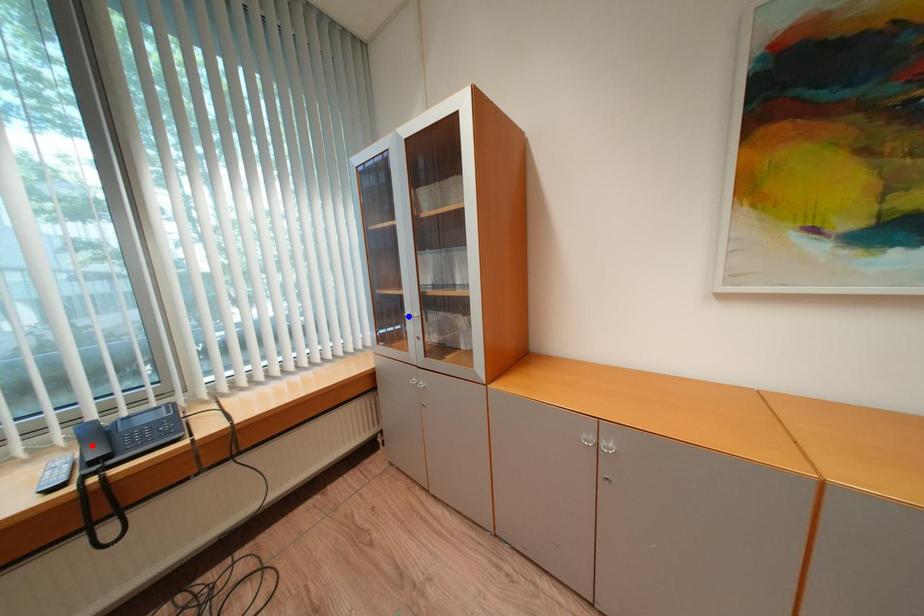
Question: Two points are marked on the image. Which point is closer to the camera?

Choices:
 (A) Blue point is closer.
 (B) Red point is closer.

Answer: (B)